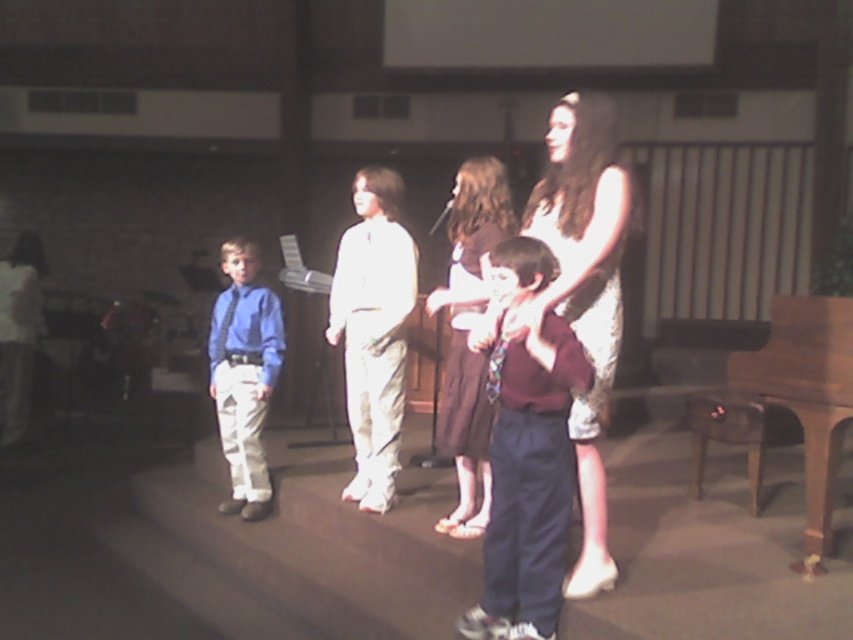
Question: Which of these objects is positioned farthest from the shiny silver dress at center?

Choices:
 (A) matte brown dress at center
 (B) matte blue shirt at center
 (C) white cotton pants at center
 (D) maroon fabric shirt at center

Answer: (B)

Question: Which object is the closest to the shiny silver dress at center?

Choices:
 (A) white cotton pants at center
 (B) matte brown dress at center
 (C) maroon fabric shirt at center

Answer: (C)

Question: Which point appears closest to the camera in this image?

Choices:
 (A) (589, 378)
 (B) (370, 208)
 (C) (502, 225)

Answer: (A)

Question: Is maroon fabric shirt at center wider than white cotton pants at center?

Choices:
 (A) no
 (B) yes

Answer: (A)

Question: Does shiny silver dress at center appear on the left side of matte brown dress at center?

Choices:
 (A) yes
 (B) no

Answer: (B)

Question: Is the position of shiny silver dress at center less distant than that of white cotton pants at center?

Choices:
 (A) yes
 (B) no

Answer: (A)